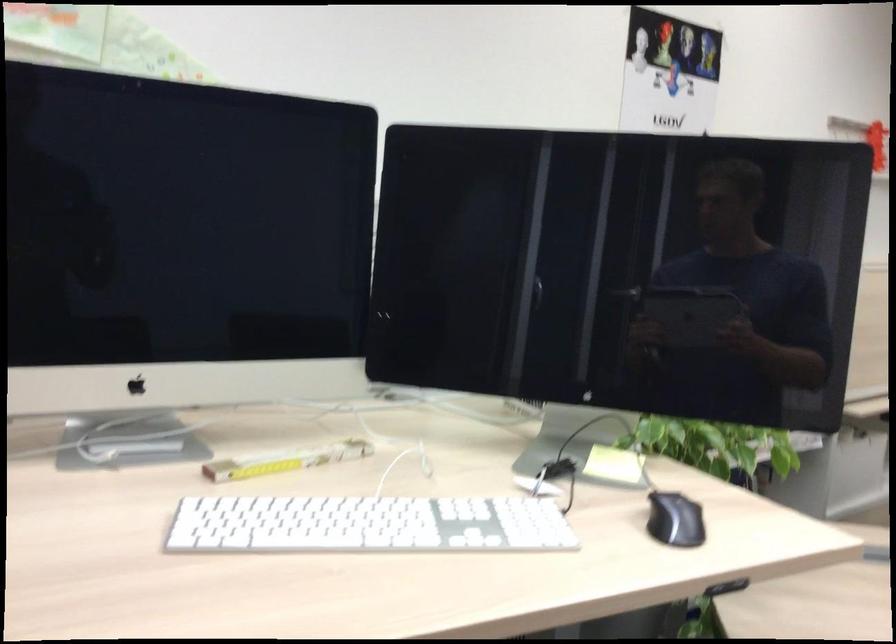
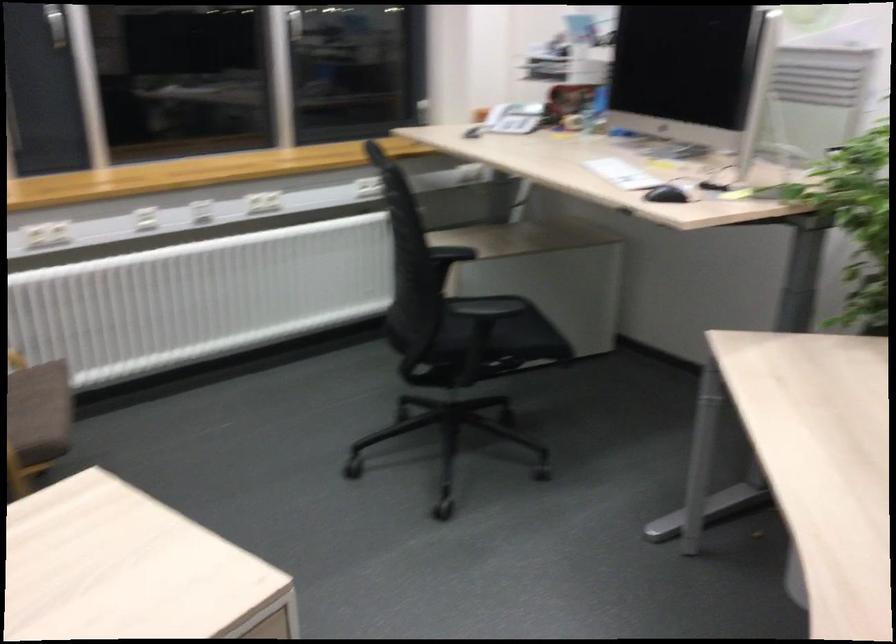
Locate, in the second image, the point that corresponds to (385,540) in the first image.

(622, 174)